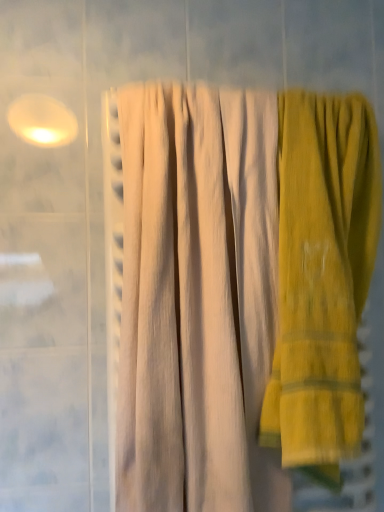
Question: Would you say beige textured towel at center contains yellow corduroy towel at right?

Choices:
 (A) no
 (B) yes

Answer: (A)

Question: Can you confirm if beige textured towel at center is positioned to the left of yellow corduroy towel at right?

Choices:
 (A) no
 (B) yes

Answer: (B)

Question: From a real-world perspective, does beige textured towel at center sit lower than yellow corduroy towel at right?

Choices:
 (A) yes
 (B) no

Answer: (B)

Question: Is beige textured towel at center next to yellow corduroy towel at right?

Choices:
 (A) yes
 (B) no

Answer: (B)

Question: Does beige textured towel at center have a lesser width compared to yellow corduroy towel at right?

Choices:
 (A) no
 (B) yes

Answer: (A)

Question: Is beige textured towel at center closer to camera compared to yellow corduroy towel at right?

Choices:
 (A) no
 (B) yes

Answer: (B)

Question: From a real-world perspective, is yellow corduroy towel at right below beige textured towel at center?

Choices:
 (A) no
 (B) yes

Answer: (B)

Question: Would you say yellow corduroy towel at right is outside beige textured towel at center?

Choices:
 (A) yes
 (B) no

Answer: (A)

Question: Is the surface of yellow corduroy towel at right in direct contact with beige textured towel at center?

Choices:
 (A) no
 (B) yes

Answer: (A)

Question: From the image's perspective, is yellow corduroy towel at right located above beige textured towel at center?

Choices:
 (A) no
 (B) yes

Answer: (A)

Question: Is yellow corduroy towel at right smaller than beige textured towel at center?

Choices:
 (A) yes
 (B) no

Answer: (A)

Question: Could you tell me if yellow corduroy towel at right is turned towards beige textured towel at center?

Choices:
 (A) yes
 (B) no

Answer: (B)

Question: From their relative heights in the image, would you say yellow corduroy towel at right is taller or shorter than beige textured towel at center?

Choices:
 (A) tall
 (B) short

Answer: (B)